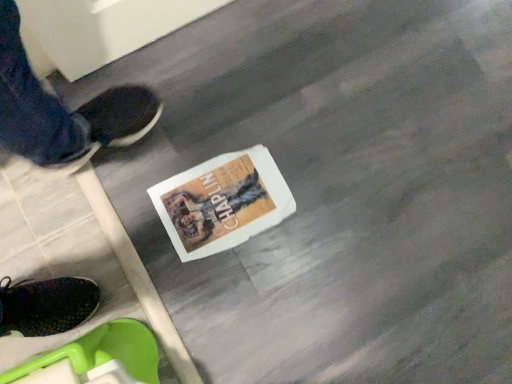
The image size is (512, 384). In order to click on vacant area that is situated to the right of white paper magazine at center in this screenshot , I will do `click(310, 221)`.